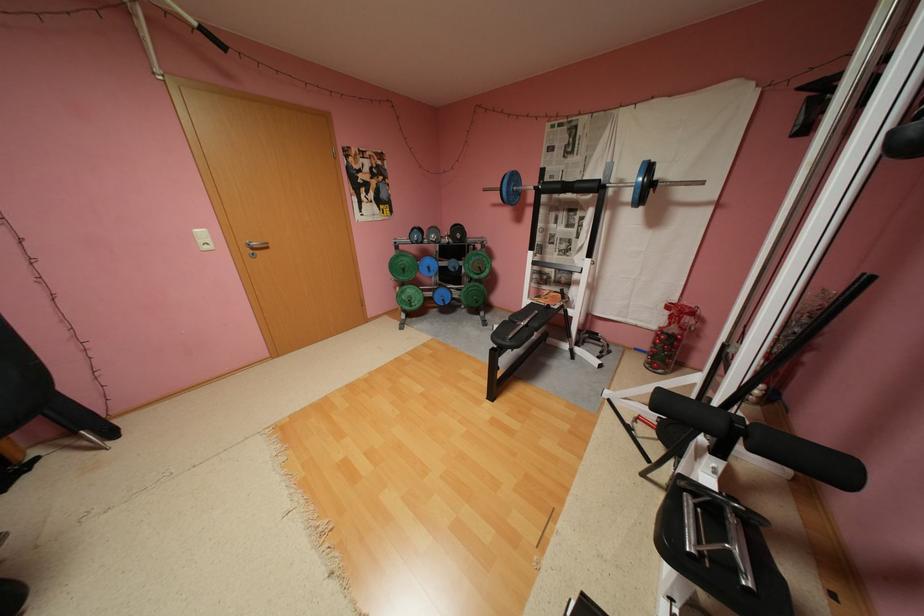
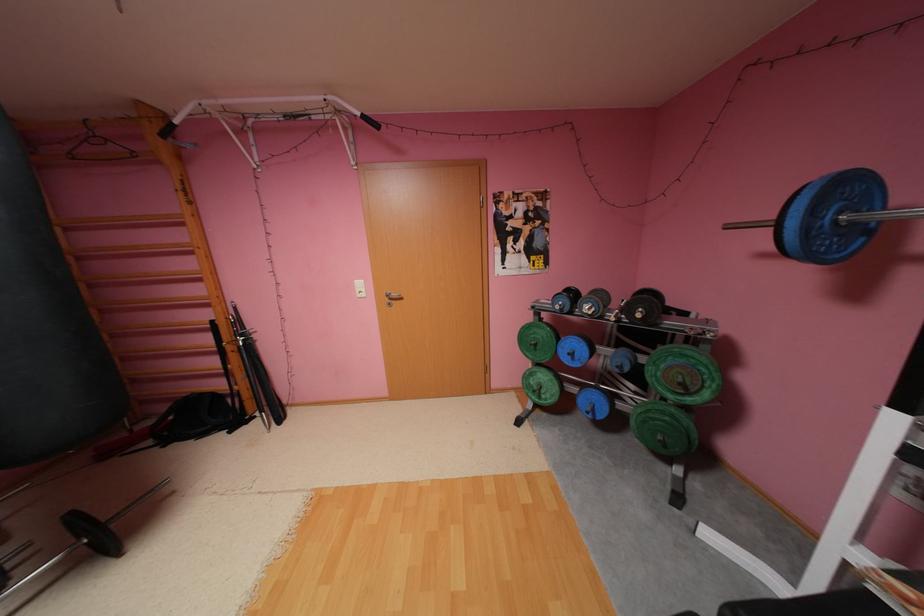
Locate, in the second image, the point that corresponds to the point at 489,267 in the first image.

(690, 384)